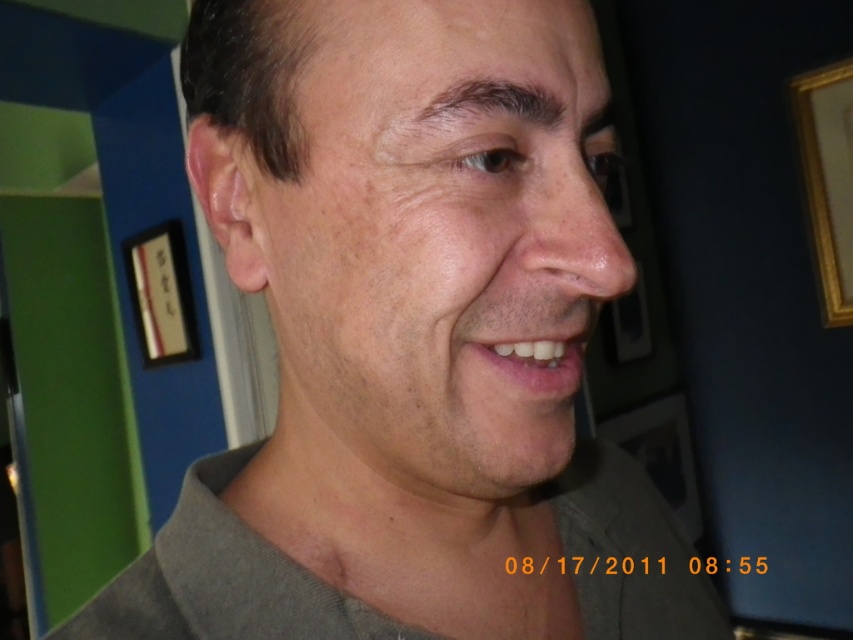
Is point (515, 241) closer to viewer compared to point (822, 205)?

That is True.

At what (x,y) coordinates should I click in order to perform the action: click on smooth skin face at center. Please return your answer as a coordinate pair (x, y). This screenshot has width=853, height=640. Looking at the image, I should click on (437, 248).

Find the location of a particular element. gray fabric at lower center is located at coordinates click(x=223, y=580).

Is gray fabric at lower center above matte black picture frame at upper left?

No.

Who is more forward, (276,561) or (163,288)?

Positioned in front is point (276,561).

Find the location of a particular element. This screenshot has height=640, width=853. gray fabric at lower center is located at coordinates (223, 580).

From the picture: Does gold metallic picture frame at upper right have a lesser width compared to white glossy teeth at center?

No.

Is point (802, 145) in front of point (582, 348)?

No, (802, 145) is further to viewer.

What are the coordinates of `gold metallic picture frame at upper right` in the screenshot? It's located at (827, 179).